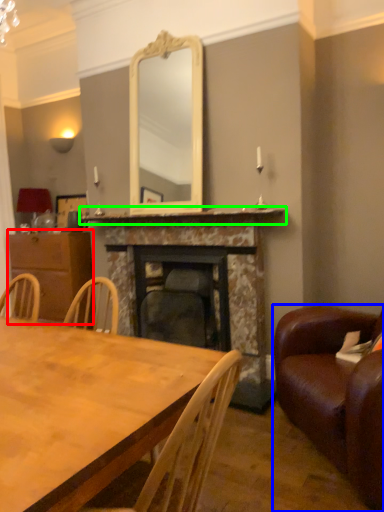
Question: Considering the real-world distances, which object is farthest from cabinetry (highlighted by a red box)? studio couch (highlighted by a blue box) or mantle (highlighted by a green box)?

Choices:
 (A) studio couch
 (B) mantle

Answer: (A)